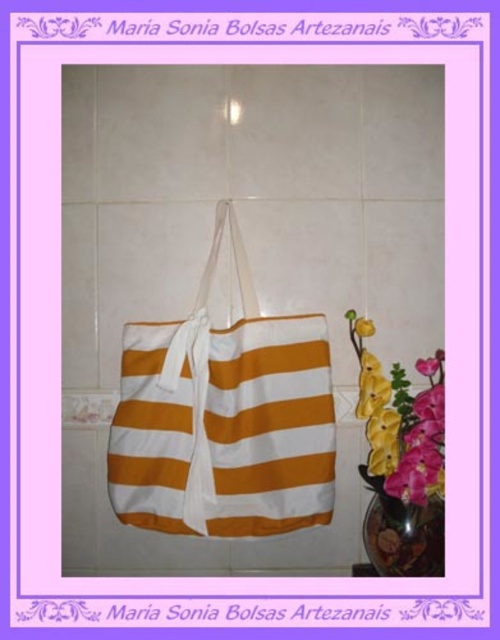
Question: Is white cotton tote at center in front of yellow fabric flower at right?

Choices:
 (A) yes
 (B) no

Answer: (A)

Question: In this image, where is white cotton tote at center located relative to yellow fabric flower at right?

Choices:
 (A) below
 (B) above

Answer: (A)

Question: Which point is farther from the camera taking this photo?

Choices:
 (A) pyautogui.click(x=361, y=316)
 (B) pyautogui.click(x=249, y=388)

Answer: (A)

Question: Observing the image, what is the correct spatial positioning of white cotton tote at center in reference to yellow fabric flower at right?

Choices:
 (A) below
 (B) above

Answer: (A)

Question: Which point is closer to the camera?

Choices:
 (A) (353, 323)
 (B) (328, 472)

Answer: (B)